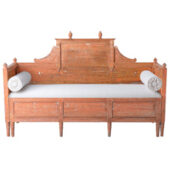
In order to click on bench leg 3 in this screenshot , I will do `click(60, 131)`.